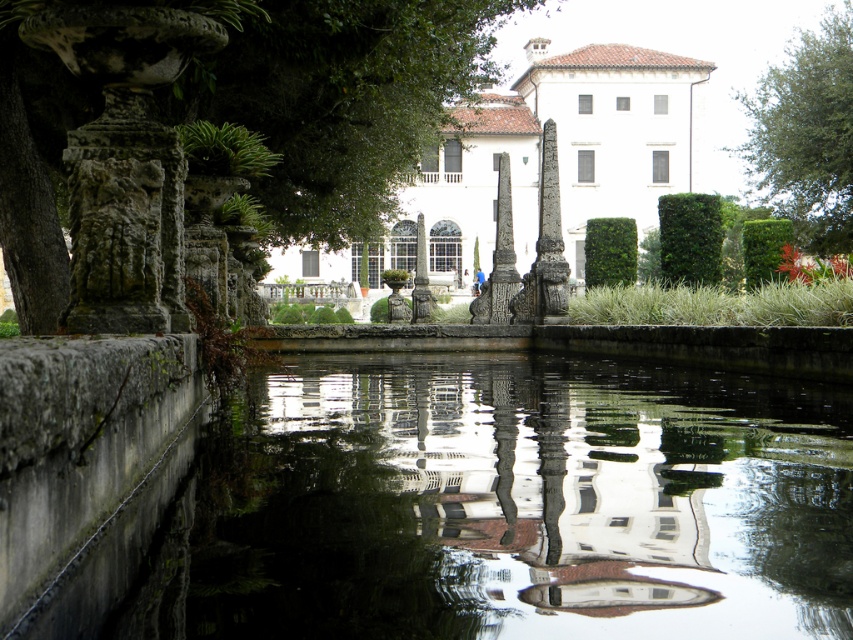
You are a landscape architect designing a path that needs to pass between the smooth concrete water at center and the green leafy tree at upper right. Which object requires more consideration in terms of width for the path design?

The green leafy tree at upper right requires more consideration in terms of width for the path design because it has a greater width than the smooth concrete water at center according to the description.

You are standing in the garden scene and want to locate the green leafy tree at left. Based on the coordinate system where the bottom left corner is the origin, can you tell me its exact location?

The green leafy tree at left is located at coordinate point (251, 113).